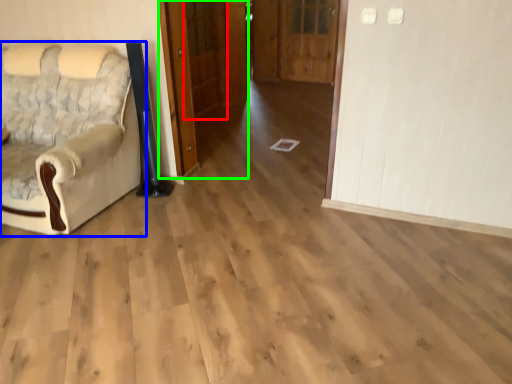
Question: Which object is the farthest from door (highlighted by a red box)? Choose among these: chair (highlighted by a blue box) or door (highlighted by a green box).

Choices:
 (A) chair
 (B) door

Answer: (A)